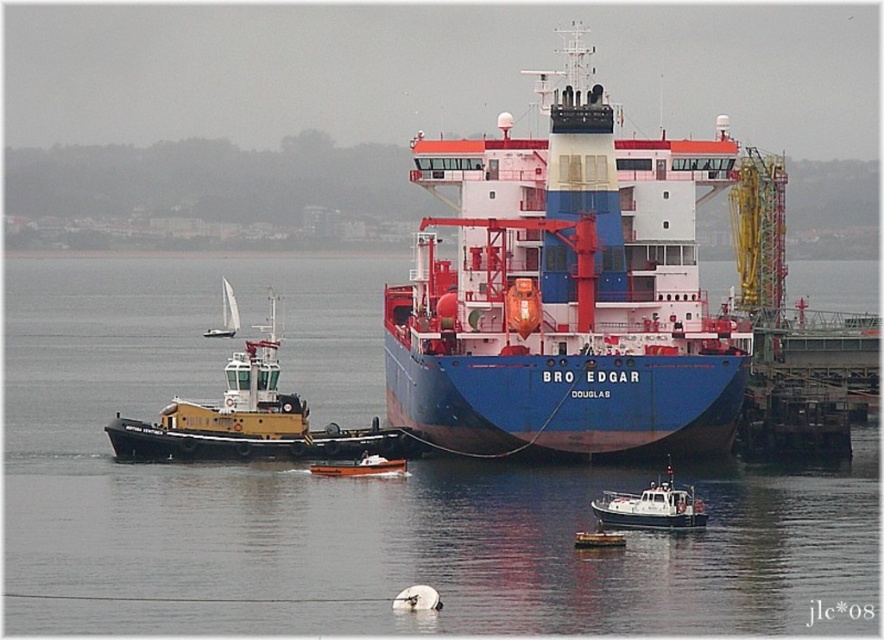
Question: Which point is closer to the camera?

Choices:
 (A) (225, 284)
 (B) (264, 444)

Answer: (B)

Question: Among these points, which one is farthest from the camera?

Choices:
 (A) (351, 476)
 (B) (499, 186)

Answer: (B)

Question: Does blue matte cargo ship at center have a smaller size compared to yellow matte tugboat at left?

Choices:
 (A) yes
 (B) no

Answer: (B)

Question: Is yellow matte tugboat at left smaller than brushed metal boat at lower center?

Choices:
 (A) yes
 (B) no

Answer: (B)

Question: Does white plastic boat at lower right appear over white sailboat at upper left?

Choices:
 (A) yes
 (B) no

Answer: (B)

Question: Which object is closer to the camera taking this photo?

Choices:
 (A) blue matte water at center
 (B) white plastic boat at lower right

Answer: (A)